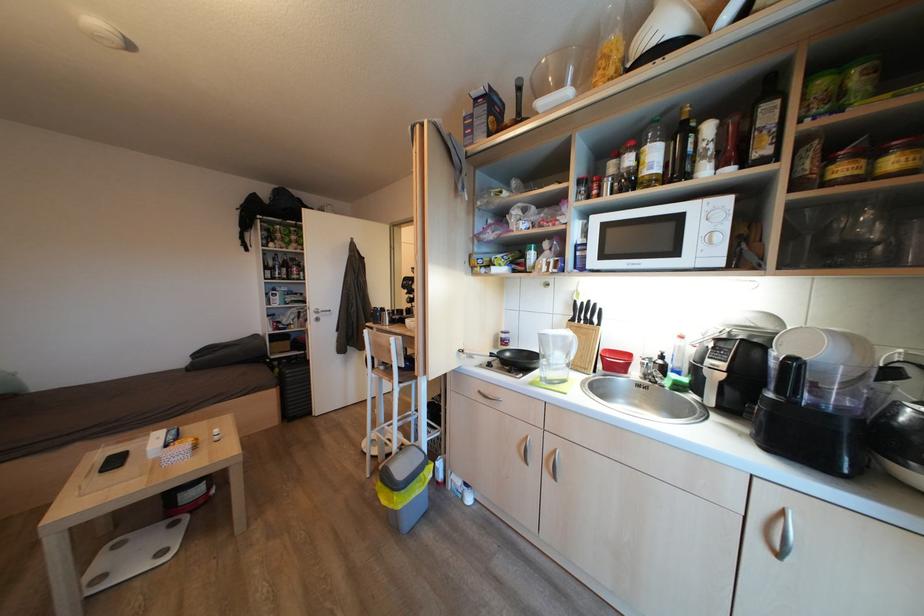
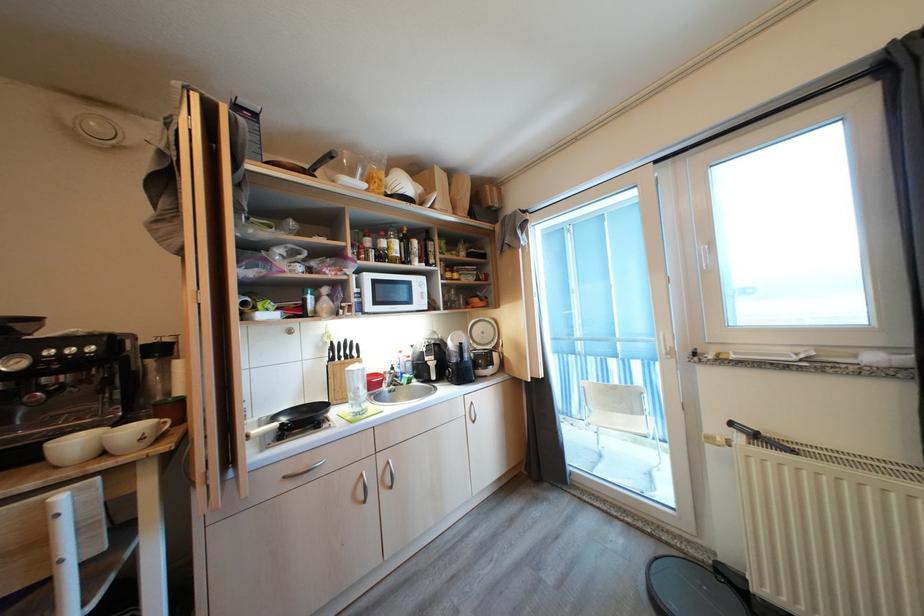
Locate, in the second image, the point that corresponds to pixel 666 361 in the first image.

(397, 371)